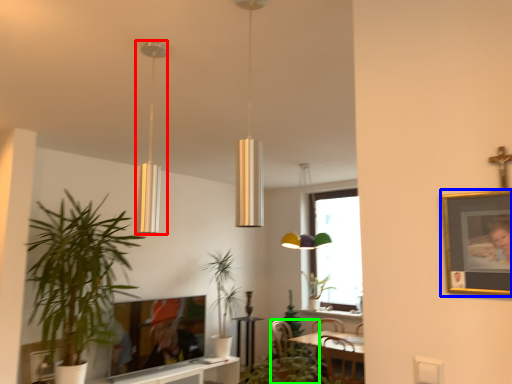
Question: Which object is positioned farthest from lamp (highlighted by a red box)? Select from picture frame (highlighted by a blue box) and swivel chair (highlighted by a green box).

Choices:
 (A) picture frame
 (B) swivel chair

Answer: (B)